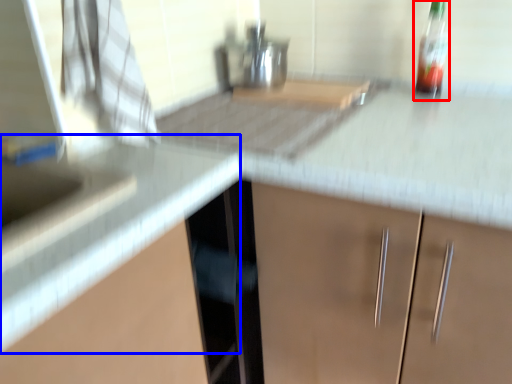
Question: Which object appears closest to the camera in this image, bottle (highlighted by a red box) or counter top (highlighted by a blue box)?

Choices:
 (A) bottle
 (B) counter top

Answer: (B)